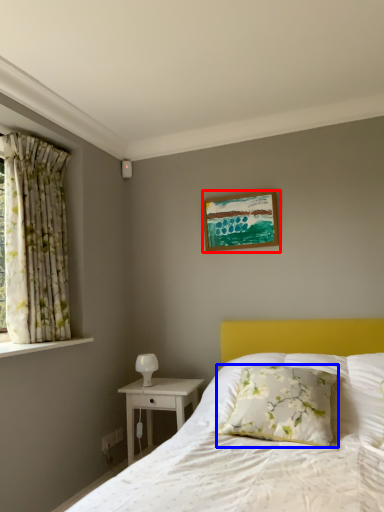
Question: Which object is further to the camera taking this photo, picture frame (highlighted by a red box) or pillow (highlighted by a blue box)?

Choices:
 (A) picture frame
 (B) pillow

Answer: (A)